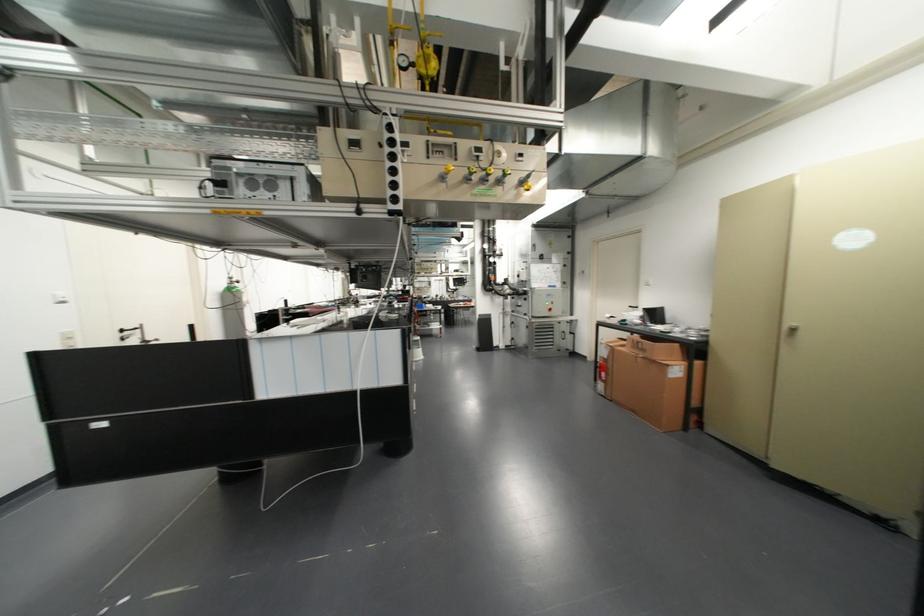
The width and height of the screenshot is (924, 616). I want to click on cabinet door handle, so click(792, 329).